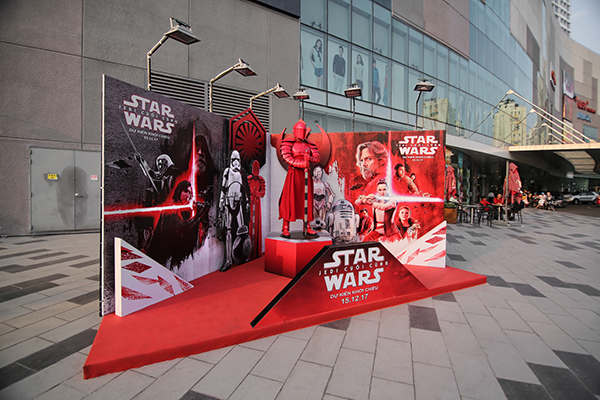
Locate an element on the screen. The width and height of the screenshot is (600, 400). stage is located at coordinates (190, 332).